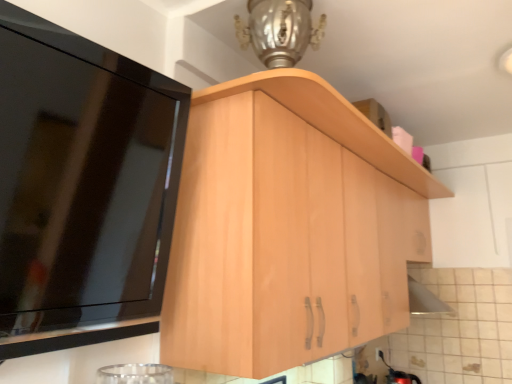
What do you see at coordinates (82, 187) in the screenshot? The width and height of the screenshot is (512, 384). I see `light wood cabinet at upper left, which is counted as the first cabinetry, starting from the left` at bounding box center [82, 187].

What is the approximate height of light wood cabinet at upper left, which is the second cabinetry from right to left?

66.00 centimeters.

Locate an element on the screen. The width and height of the screenshot is (512, 384). light wood cabinet at upper left, which is counted as the first cabinetry, starting from the left is located at coordinates (82, 187).

The height and width of the screenshot is (384, 512). What do you see at coordinates (288, 228) in the screenshot?
I see `light wood cabinet at center, acting as the first cabinetry starting from the right` at bounding box center [288, 228].

Measure the distance between point (x=335, y=215) and camera.

Point (x=335, y=215) is 4.76 feet from camera.

Locate an element on the screen. This screenshot has height=384, width=512. light wood cabinet at center, which is the 2th cabinetry in front-to-back order is located at coordinates (288, 228).

What is the approximate width of light wood cabinet at center, the second cabinetry in the left-to-right sequence?

The width of light wood cabinet at center, the second cabinetry in the left-to-right sequence, is 19.43 inches.

This screenshot has height=384, width=512. Identify the location of light wood cabinet at upper left, which is counted as the first cabinetry, starting from the left. (82, 187).

Which is more to the right, light wood cabinet at upper left, positioned as the first cabinetry in front-to-back order, or light wood cabinet at center, the 1th cabinetry viewed from the back?

From the viewer's perspective, light wood cabinet at center, the 1th cabinetry viewed from the back, appears more on the right side.

Is light wood cabinet at upper left, which is the second cabinetry from right to left, in front of or behind light wood cabinet at center, which is the 2th cabinetry in front-to-back order, in the image?

Clearly, light wood cabinet at upper left, which is the second cabinetry from right to left, is in front of light wood cabinet at center, which is the 2th cabinetry in front-to-back order.

Is point (112, 189) farther from viewer compared to point (225, 313)?

That is False.

From the image's perspective, between light wood cabinet at upper left, the second cabinetry when ordered from back to front, and light wood cabinet at center, which is the 2th cabinetry in front-to-back order, which one is located above?

light wood cabinet at upper left, the second cabinetry when ordered from back to front, is shown above in the image.

From a real-world perspective, relative to light wood cabinet at center, the second cabinetry in the left-to-right sequence, is light wood cabinet at upper left, which is the second cabinetry from right to left, vertically above or below?

Clearly, from a real-world perspective, light wood cabinet at upper left, which is the second cabinetry from right to left, is above light wood cabinet at center, the second cabinetry in the left-to-right sequence.

Considering the sizes of objects light wood cabinet at upper left, which is the second cabinetry from right to left, and light wood cabinet at center, the 1th cabinetry viewed from the back, in the image provided, who is thinner, light wood cabinet at upper left, which is the second cabinetry from right to left, or light wood cabinet at center, the 1th cabinetry viewed from the back,?

With smaller width is light wood cabinet at upper left, which is the second cabinetry from right to left.

In the scene shown: Is light wood cabinet at upper left, which is counted as the first cabinetry, starting from the left, taller than light wood cabinet at center, the second cabinetry in the left-to-right sequence?

No, light wood cabinet at upper left, which is counted as the first cabinetry, starting from the left, is not taller than light wood cabinet at center, the second cabinetry in the left-to-right sequence.

Between light wood cabinet at upper left, which is the second cabinetry from right to left, and light wood cabinet at center, which is the 2th cabinetry in front-to-back order, which one has smaller size?

With smaller size is light wood cabinet at upper left, which is the second cabinetry from right to left.

Is light wood cabinet at upper left, the second cabinetry when ordered from back to front, completely or partially outside of light wood cabinet at center, the second cabinetry in the left-to-right sequence?

Yes, light wood cabinet at upper left, the second cabinetry when ordered from back to front, is located beyond the bounds of light wood cabinet at center, the second cabinetry in the left-to-right sequence.

Is the surface of light wood cabinet at upper left, the second cabinetry when ordered from back to front, in direct contact with light wood cabinet at center, the second cabinetry in the left-to-right sequence?

No, light wood cabinet at upper left, the second cabinetry when ordered from back to front, is not touching light wood cabinet at center, the second cabinetry in the left-to-right sequence.

Looking at this image, is light wood cabinet at upper left, positioned as the first cabinetry in front-to-back order, oriented away from light wood cabinet at center, which is the 2th cabinetry in front-to-back order?

light wood cabinet at upper left, positioned as the first cabinetry in front-to-back order, is not turned away from light wood cabinet at center, which is the 2th cabinetry in front-to-back order.

This screenshot has width=512, height=384. There is a light wood cabinet at center, acting as the first cabinetry starting from the right. What are the coordinates of `cabinetry above it (from a real-world perspective)` in the screenshot? It's located at (82, 187).

Considering the positions of objects light wood cabinet at center, the 1th cabinetry viewed from the back, and light wood cabinet at upper left, the second cabinetry when ordered from back to front, in the image provided, who is more to the left, light wood cabinet at center, the 1th cabinetry viewed from the back, or light wood cabinet at upper left, the second cabinetry when ordered from back to front,?

light wood cabinet at upper left, the second cabinetry when ordered from back to front, is more to the left.

Does light wood cabinet at center, acting as the first cabinetry starting from the right, lie in front of light wood cabinet at upper left, which is the second cabinetry from right to left?

No, light wood cabinet at center, acting as the first cabinetry starting from the right, is further to the viewer.

Which is in front, point (303, 118) or point (106, 105)?

The point (106, 105) is closer to the camera.

From the image's perspective, relative to light wood cabinet at upper left, which is counted as the first cabinetry, starting from the left, is light wood cabinet at center, the second cabinetry in the left-to-right sequence, above or below?

light wood cabinet at center, the second cabinetry in the left-to-right sequence, is below light wood cabinet at upper left, which is counted as the first cabinetry, starting from the left.

From a real-world perspective, which object stands above the other?

light wood cabinet at upper left, which is the second cabinetry from right to left.

Considering the relative sizes of light wood cabinet at center, the 1th cabinetry viewed from the back, and light wood cabinet at upper left, the second cabinetry when ordered from back to front, in the image provided, is light wood cabinet at center, the 1th cabinetry viewed from the back, wider than light wood cabinet at upper left, the second cabinetry when ordered from back to front,?

Correct, the width of light wood cabinet at center, the 1th cabinetry viewed from the back, exceeds that of light wood cabinet at upper left, the second cabinetry when ordered from back to front.

Considering the sizes of objects light wood cabinet at center, which is the 2th cabinetry in front-to-back order, and light wood cabinet at upper left, positioned as the first cabinetry in front-to-back order, in the image provided, who is shorter, light wood cabinet at center, which is the 2th cabinetry in front-to-back order, or light wood cabinet at upper left, positioned as the first cabinetry in front-to-back order,?

Standing shorter between the two is light wood cabinet at upper left, positioned as the first cabinetry in front-to-back order.

Is light wood cabinet at center, the 1th cabinetry viewed from the back, bigger than light wood cabinet at upper left, which is the second cabinetry from right to left?

Yes.

Is light wood cabinet at upper left, which is counted as the first cabinetry, starting from the left, a part of light wood cabinet at center, the 1th cabinetry viewed from the back?

No, light wood cabinet at center, the 1th cabinetry viewed from the back, does not contain light wood cabinet at upper left, which is counted as the first cabinetry, starting from the left.

Are light wood cabinet at center, which is the 2th cabinetry in front-to-back order, and light wood cabinet at upper left, positioned as the first cabinetry in front-to-back order, located far from each other?

No, there isn't a large distance between light wood cabinet at center, which is the 2th cabinetry in front-to-back order, and light wood cabinet at upper left, positioned as the first cabinetry in front-to-back order.

Based on the photo, is light wood cabinet at center, which is the 2th cabinetry in front-to-back order, oriented towards light wood cabinet at upper left, positioned as the first cabinetry in front-to-back order?

No, light wood cabinet at center, which is the 2th cabinetry in front-to-back order, is not oriented towards light wood cabinet at upper left, positioned as the first cabinetry in front-to-back order.

How many degrees apart are the facing directions of light wood cabinet at center, acting as the first cabinetry starting from the right, and light wood cabinet at upper left, which is the second cabinetry from right to left?

The facing directions of light wood cabinet at center, acting as the first cabinetry starting from the right, and light wood cabinet at upper left, which is the second cabinetry from right to left, are 0.177 degrees apart.

How far apart are light wood cabinet at center, the 1th cabinetry viewed from the back, and light wood cabinet at upper left, positioned as the first cabinetry in front-to-back order?

light wood cabinet at center, the 1th cabinetry viewed from the back, is 17.92 inches from light wood cabinet at upper left, positioned as the first cabinetry in front-to-back order.

The image size is (512, 384). I want to click on cabinetry located below the light wood cabinet at upper left, which is the second cabinetry from right to left (from the image's perspective), so click(288, 228).

This screenshot has height=384, width=512. Find the location of `cabinetry located on the right of light wood cabinet at upper left, which is counted as the first cabinetry, starting from the left`. cabinetry located on the right of light wood cabinet at upper left, which is counted as the first cabinetry, starting from the left is located at coordinates (288, 228).

Locate an element on the screen. This screenshot has width=512, height=384. cabinetry behind the light wood cabinet at upper left, which is the second cabinetry from right to left is located at coordinates (288, 228).